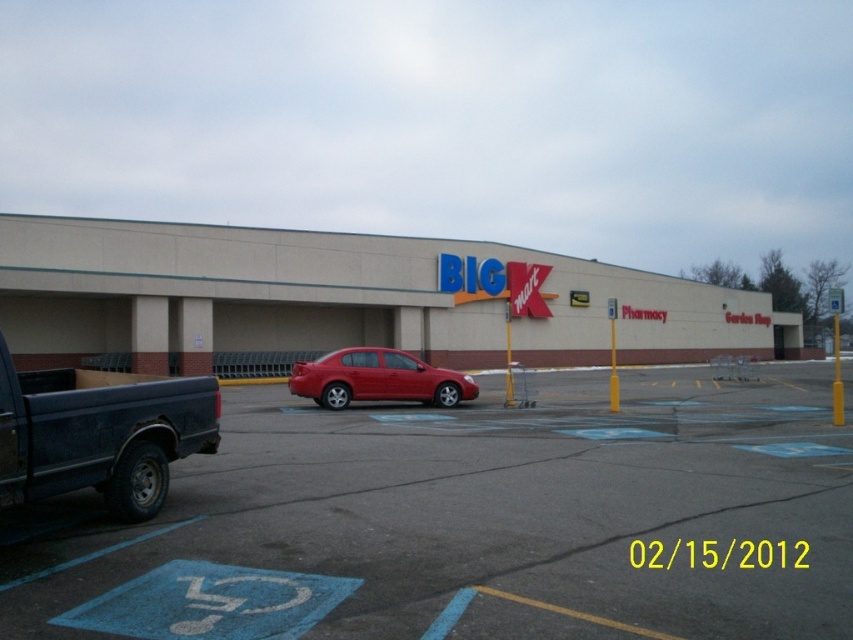
You are a delivery driver who needs to park your truck in the parking lot. You see the smooth asphalt parking lot at center and the matte black truck at left. Which parking spot is closer to the store entrance?

The smooth asphalt parking lot at center is closer to the store entrance because it is in front of the matte black truck at left, which is positioned further away from the entrance.

You are a customer arriving at the BIG Kmart store. You see the beige concrete building at center and the matte red sedan at center. Which object is closer to the store entrance?

The beige concrete building at center is closer to the store entrance because the matte red sedan at center is behind it.

You are planning to park your car in the parking lot at center. The beige concrete building at center has a loading dock on its side. If the loading dock is 10 feet wide, can the smooth asphalt parking lot at center accommodate a delivery truck that requires a 12 feet wide space?

The smooth asphalt parking lot at center has a width less than the beige concrete building at center. Since the loading dock is 10 feet wide and the required space is 12 feet, the parking lot may not be wide enough to accommodate the delivery truck.